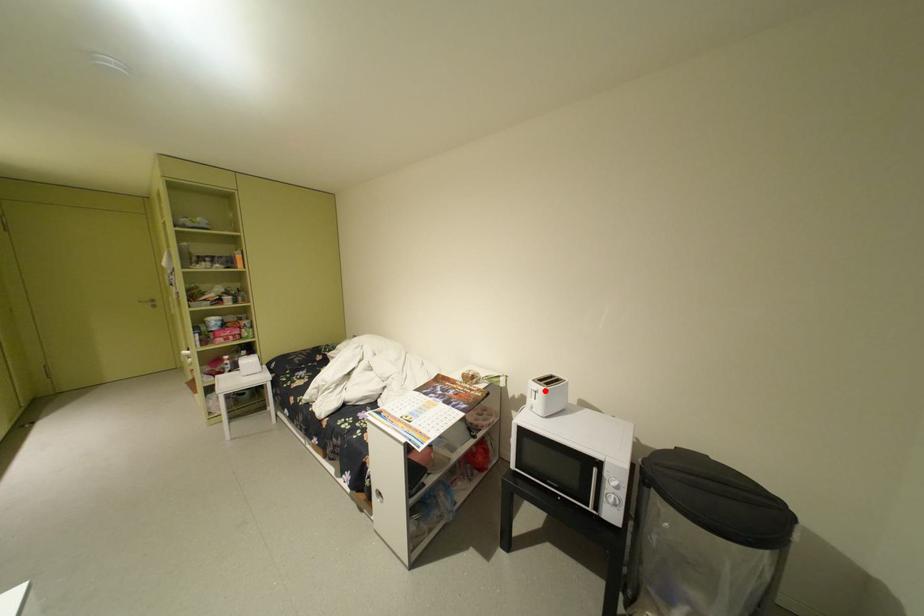
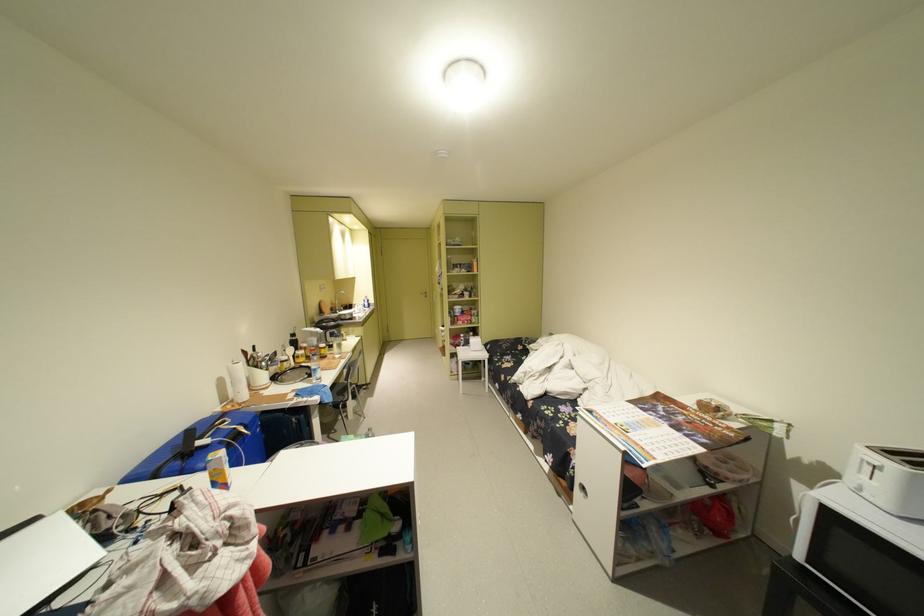
Find the pixel in the second image that matches the highlighted location in the first image.

(881, 464)